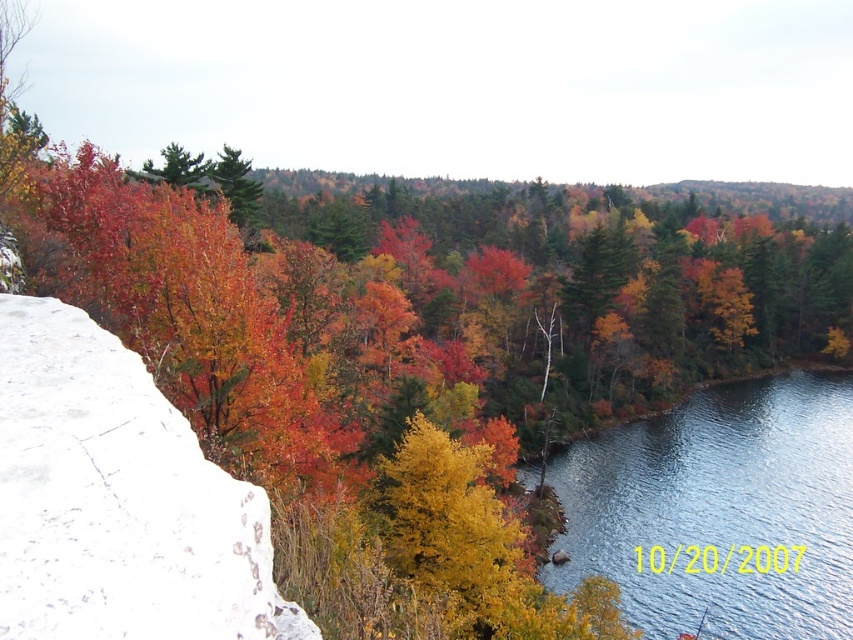
You are a hiker standing at the base of the cliff and want to place a 2.5 meter long tent between yourself and the white rough stone at left. Can you fit the tent in that space?

The distance between you and the white rough stone at left is 2.65 meters, so the 2.5 meter long tent can fit with 0.15 meters of space remaining.

You are a geologist examining the autumn landscape. You need to locate the white rough stone at left. According to the coordinates provided, where exactly is it positioned in the image?

The white rough stone at left is positioned at coordinates point [119,499] in the image.